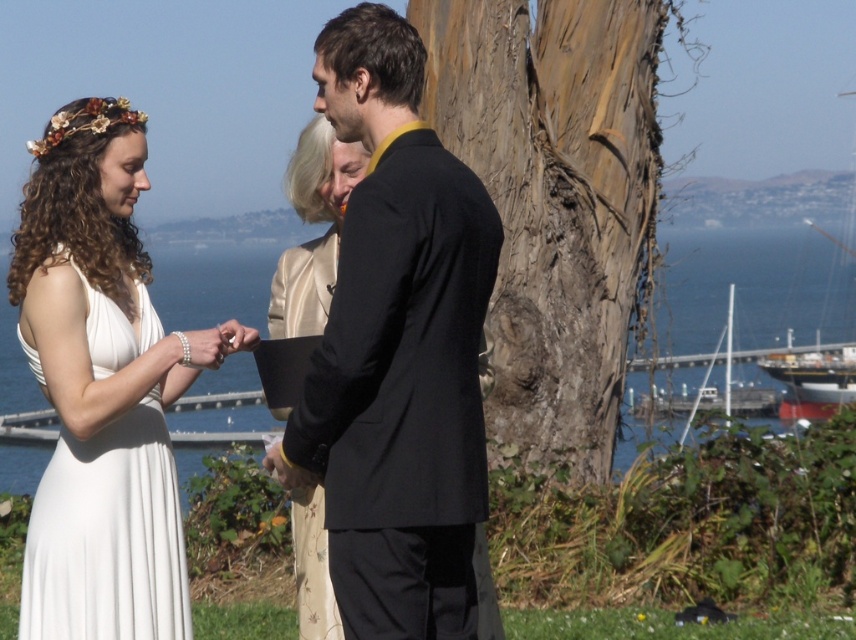
You are a photographer at the wedding ceremony. You want to take a photo that includes both the white satin dress at center and the blue water at center. Which object should be placed to the left in the frame?

The white satin dress at center is positioned on the left side of the blue water at center, so it should be placed to the left in the frame.

You are a photographer at the wedding ceremony. You want to capture a photo of the bride in her white satin dress at center without the blue water at center being visible in the background. Is this possible given their positions?

The white satin dress at center is in front of the blue water at center, so it is possible to capture a photo of the bride in her white satin dress at center without the blue water at center being visible in the background by focusing on the dress and using a shallow depth of field to blur the background.